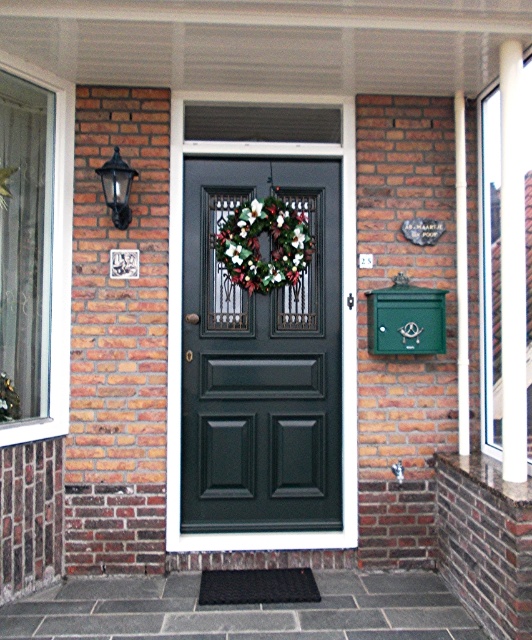
Is white smooth pillar at upper right closer to the viewer compared to green painted wood pillar at right?

Yes.

Can you confirm if white smooth pillar at upper right is wider than green painted wood pillar at right?

Correct, the width of white smooth pillar at upper right exceeds that of green painted wood pillar at right.

You are a GUI agent. You are given a task and a screenshot of the screen. Output one action in this format:
    pyautogui.click(x=<x>, y=<y>)
    Task: Click on the white smooth pillar at upper right
    This screenshot has width=532, height=640.
    Given the screenshot: What is the action you would take?
    pyautogui.click(x=512, y=264)

Who is higher up, white smooth pillar at upper right or green floral wreath at center?

green floral wreath at center is above.

Identify the location of white smooth pillar at upper right. (512, 264).

Is point (511, 54) positioned behind point (253, 211)?

No, it is in front of (253, 211).

I want to click on white smooth pillar at upper right, so click(512, 264).

Which is more to the left, green floral wreath at center or green painted wood pillar at right?

From the viewer's perspective, green floral wreath at center appears more on the left side.

Does green floral wreath at center come behind green painted wood pillar at right?

Yes, green floral wreath at center is further from the viewer.

Describe the element at coordinates (259, 244) in the screenshot. I see `green floral wreath at center` at that location.

At what (x,y) coordinates should I click in order to perform the action: click on green floral wreath at center. Please return your answer as a coordinate pair (x, y). Looking at the image, I should click on (259, 244).